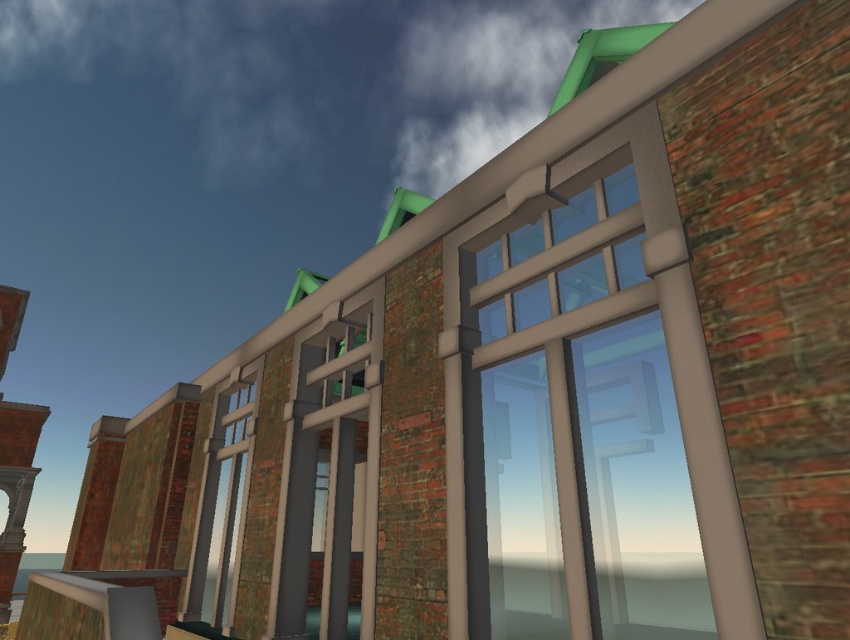
Question: Observing the image, what is the correct spatial positioning of clear glass window at center in reference to brick tower at left?

Choices:
 (A) below
 (B) above

Answer: (B)

Question: Considering the real-world distances, which object is closest to the clear glass window at upper center?

Choices:
 (A) brick tower at left
 (B) clear glass window at center

Answer: (B)

Question: Can you confirm if clear glass window at upper center is positioned above clear glass window at center?

Choices:
 (A) yes
 (B) no

Answer: (A)

Question: Does clear glass window at upper center appear on the left side of brick tower at left?

Choices:
 (A) yes
 (B) no

Answer: (B)

Question: Which point appears farthest from the camera in this image?

Choices:
 (A) (250, 429)
 (B) (27, 424)

Answer: (B)

Question: Based on their relative distances, which object is nearer to the clear glass window at upper center?

Choices:
 (A) clear glass window at center
 (B) brick tower at left

Answer: (A)